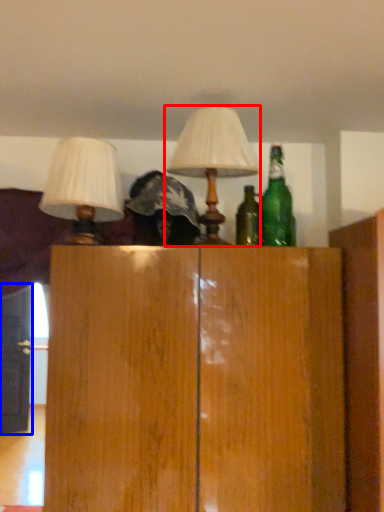
Question: Among these objects, which one is nearest to the camera, lamp (highlighted by a red box) or door (highlighted by a blue box)?

Choices:
 (A) lamp
 (B) door

Answer: (A)